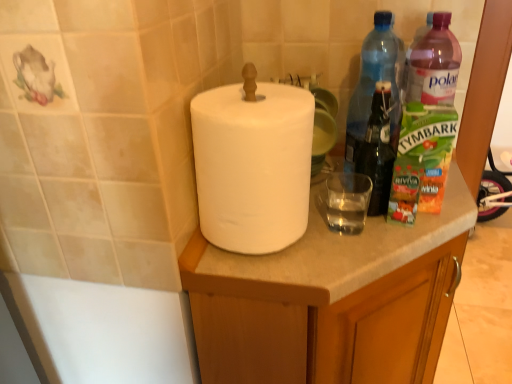
You are a GUI agent. You are given a task and a screenshot of the screen. Output one action in this format:
    pyautogui.click(x=<x>, y=<y>)
    Task: Click on the vacant region to the left of transparent plastic bottle at upper right, the second bottle in the right-to-left sequence
    
    Given the screenshot: What is the action you would take?
    pyautogui.click(x=331, y=182)